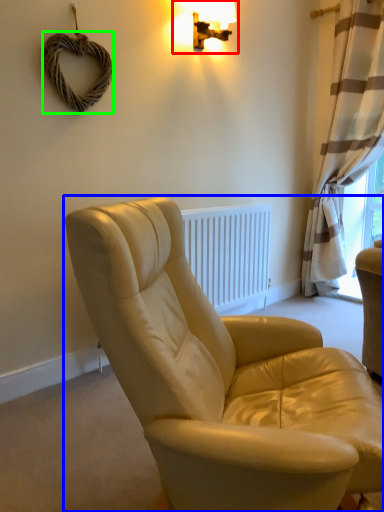
Question: Estimate the real-world distances between objects in this image. Which object is closer to lamp (highlighted by a red box), studio couch (highlighted by a blue box) or rope (highlighted by a green box)?

Choices:
 (A) studio couch
 (B) rope

Answer: (B)